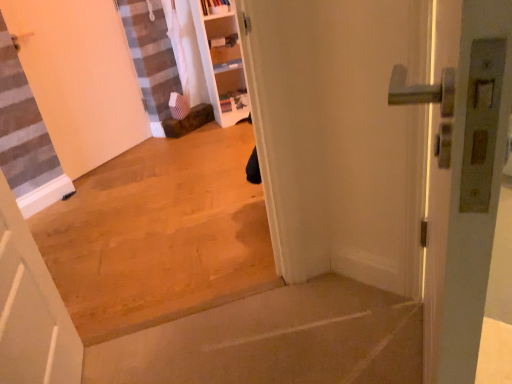
Question: Are smooth concrete step at lower center, placed as the first concrete when sorted from bottom to top, and brown wood floor at center, acting as the second concrete starting from the bottom, located far from each other?

Choices:
 (A) no
 (B) yes

Answer: (A)

Question: Is smooth concrete step at lower center, placed as the first concrete when sorted from bottom to top, shorter than brown wood floor at center, acting as the second concrete starting from the bottom?

Choices:
 (A) no
 (B) yes

Answer: (B)

Question: Considering the relative sizes of smooth concrete step at lower center, acting as the 2th concrete starting from the top, and brown wood floor at center, acting as the second concrete starting from the bottom, in the image provided, is smooth concrete step at lower center, acting as the 2th concrete starting from the top, taller than brown wood floor at center, acting as the second concrete starting from the bottom,?

Choices:
 (A) yes
 (B) no

Answer: (B)

Question: From the image's perspective, is smooth concrete step at lower center, placed as the first concrete when sorted from bottom to top, located beneath brown wood floor at center, which is the first concrete from top to bottom?

Choices:
 (A) no
 (B) yes

Answer: (B)

Question: From a real-world perspective, is smooth concrete step at lower center, acting as the 2th concrete starting from the top, located higher than brown wood floor at center, acting as the second concrete starting from the bottom?

Choices:
 (A) no
 (B) yes

Answer: (A)

Question: From the image's perspective, is white matte door at lower left, the 1th door in the front-to-back sequence, positioned above or below brown wood floor at center, which is the first concrete from top to bottom?

Choices:
 (A) below
 (B) above

Answer: (A)

Question: From a real-world perspective, relative to brown wood floor at center, which is the first concrete from top to bottom, is white matte door at lower left, which ranks as the third door in back-to-front order, vertically above or below?

Choices:
 (A) below
 (B) above

Answer: (A)

Question: From their relative heights in the image, would you say white matte door at lower left, the second door from the right, is taller or shorter than brown wood floor at center, which is the first concrete from top to bottom?

Choices:
 (A) tall
 (B) short

Answer: (B)

Question: Would you say white matte door at lower left, the 1th door in the front-to-back sequence, is to the left or to the right of brown wood floor at center, acting as the second concrete starting from the bottom, in the picture?

Choices:
 (A) left
 (B) right

Answer: (A)

Question: From a real-world perspective, is white matte door at lower left, which ranks as the third door in back-to-front order, above or below white matte door at left, which ranks as the third door in right-to-left order?

Choices:
 (A) below
 (B) above

Answer: (A)

Question: Is white matte door at lower left, the 1th door in the front-to-back sequence, bigger or smaller than white matte door at left, which ranks as the third door in right-to-left order?

Choices:
 (A) small
 (B) big

Answer: (A)

Question: Visually, is white matte door at lower left, the 1th door in the front-to-back sequence, positioned to the left or to the right of white matte door at left, positioned as the 1th door in left-to-right order?

Choices:
 (A) right
 (B) left

Answer: (A)

Question: From the image's perspective, is white matte door at lower left, the 1th door in the front-to-back sequence, above or below white matte door at left, positioned as the 1th door in left-to-right order?

Choices:
 (A) below
 (B) above

Answer: (A)

Question: Based on their positions, is white matte door at left, which is the 1th door from back to front, located to the left or right of white matte door at lower left, the second door from the right?

Choices:
 (A) right
 (B) left

Answer: (B)

Question: Considering their positions, is white matte door at left, which is the 1th door from back to front, located in front of or behind white matte door at lower left, the second door from the right?

Choices:
 (A) front
 (B) behind

Answer: (B)